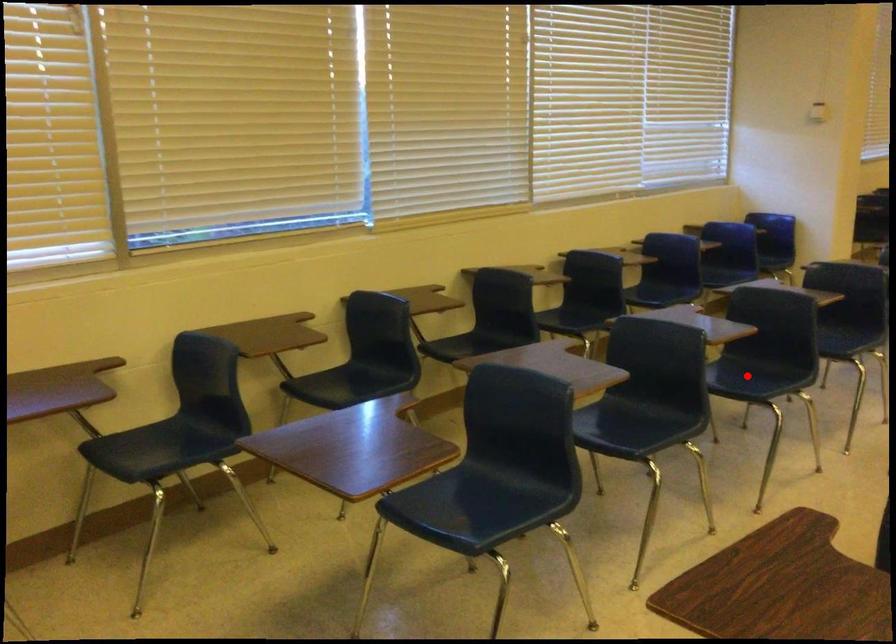
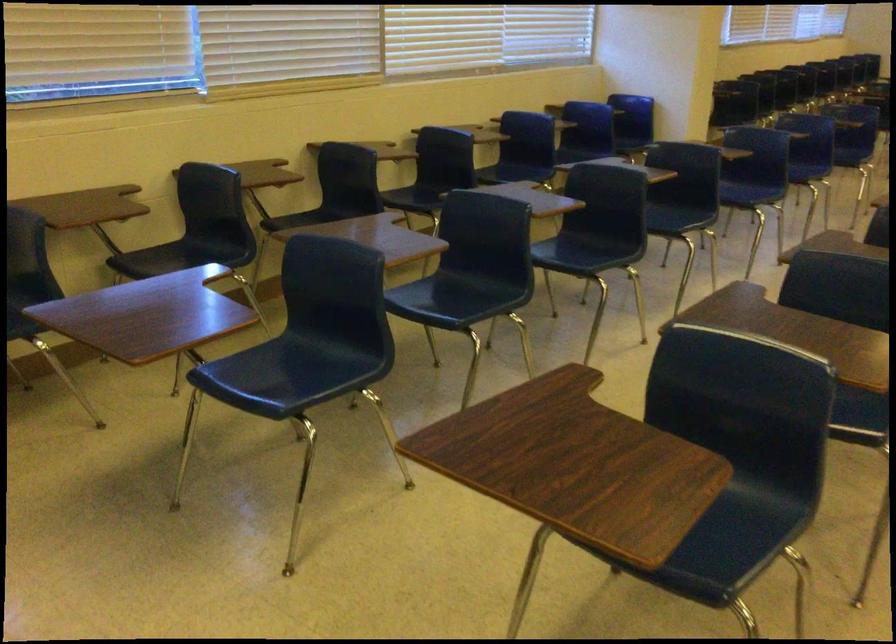
Question: I am providing you with two images of the same scene from different viewpoints. A red point is marked on the first image. Can you still see the location of the red point in image 2?

Choices:
 (A) Yes
 (B) No

Answer: (A)